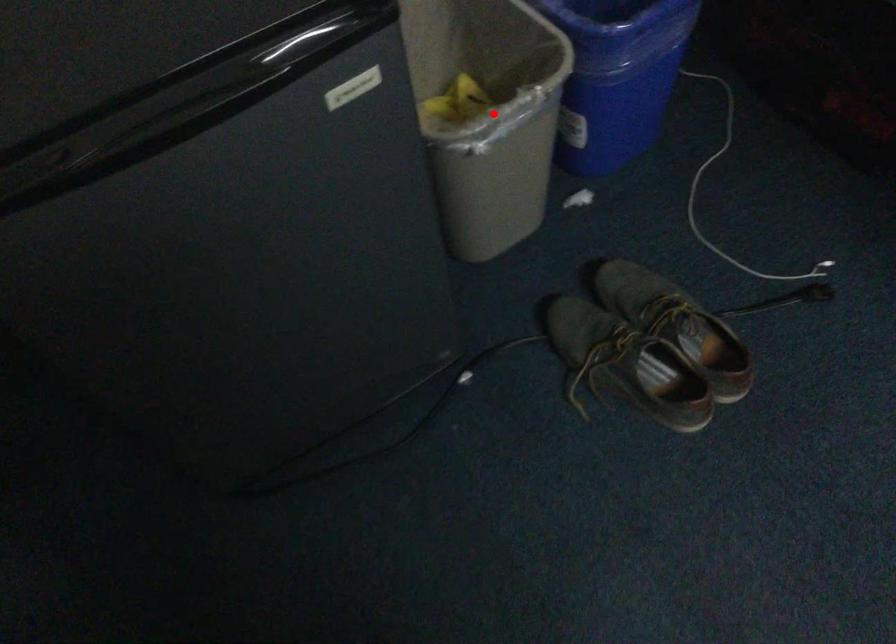
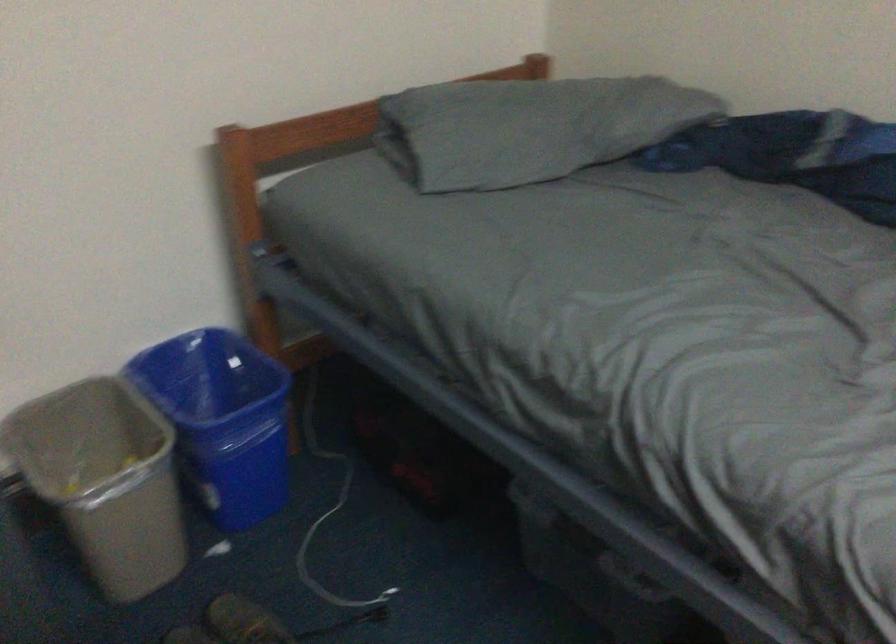
Question: I am providing you with two images of the same scene from different viewpoints. Given a red point in image1, look at the same physical point in image2. Is it:

Choices:
 (A) Closer to the viewpoint
 (B) Farther from the viewpoint

Answer: (B)